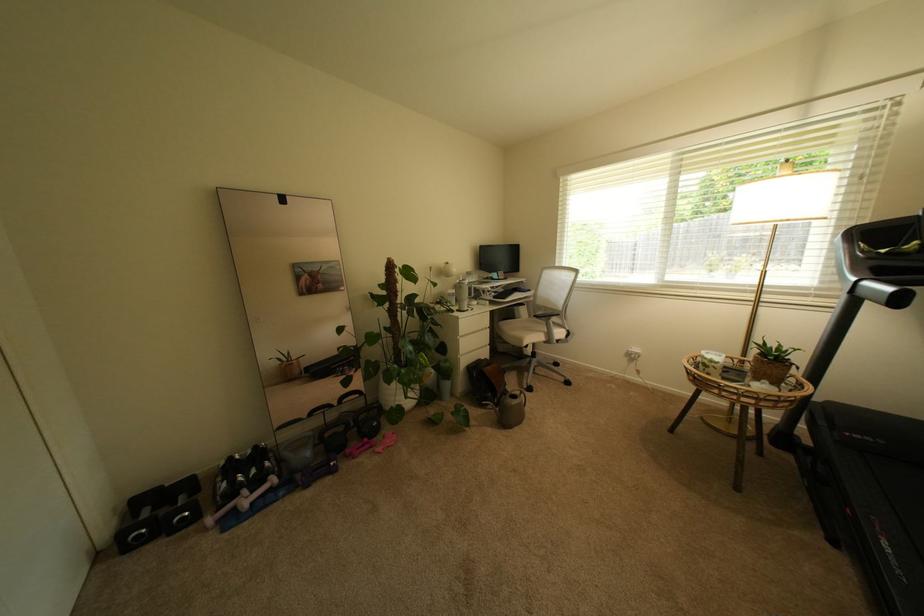
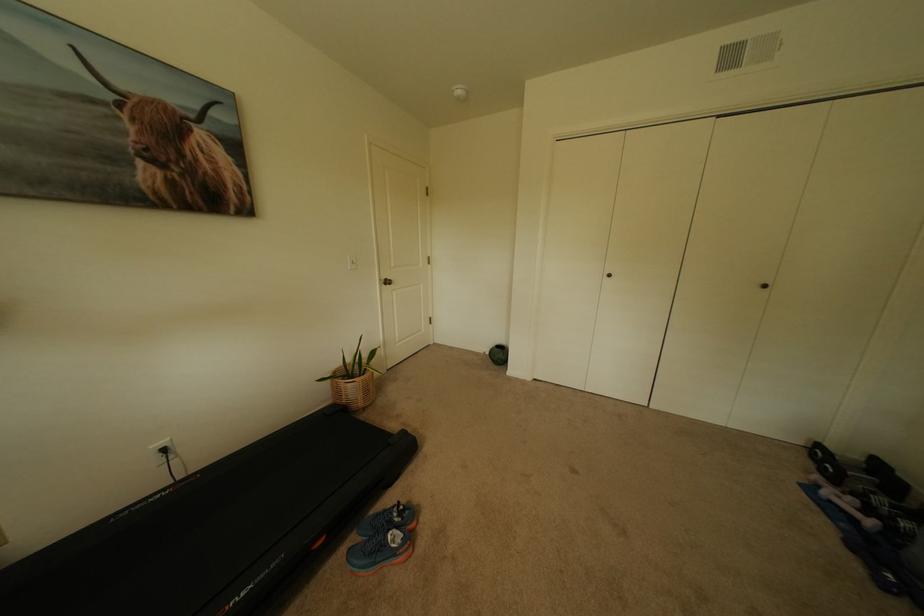
Locate, in the second image, the point that corresponds to point (280, 490) in the first image.

(862, 521)